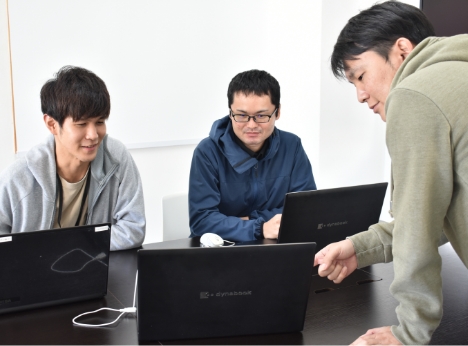
Where is `cable`? The image size is (468, 346). cable is located at coordinates (125, 307).